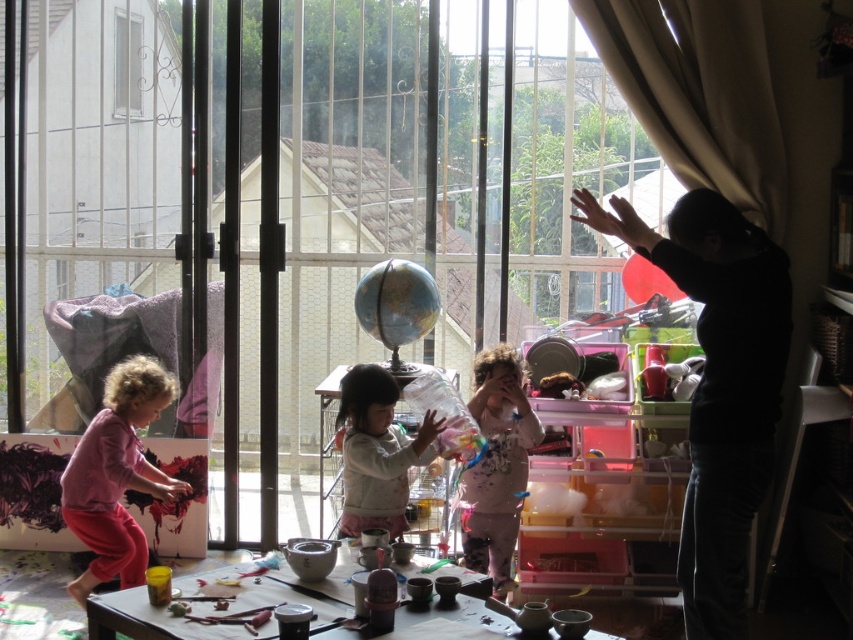
You are a child in the playroom and want to reach the red matte balloon at upper right. There is a pink fabric at left blocking your view. Which object should you move to get a clear view of the balloon?

You should move the pink fabric at left because it is in front of the red matte balloon at upper right and blocking your view.

You are a child in the playroom looking at the rubber balloon at center and the red matte balloon at upper right. Which balloon is nearer to you?

The rubber balloon at center is closer to the viewer than the red matte balloon at upper right.